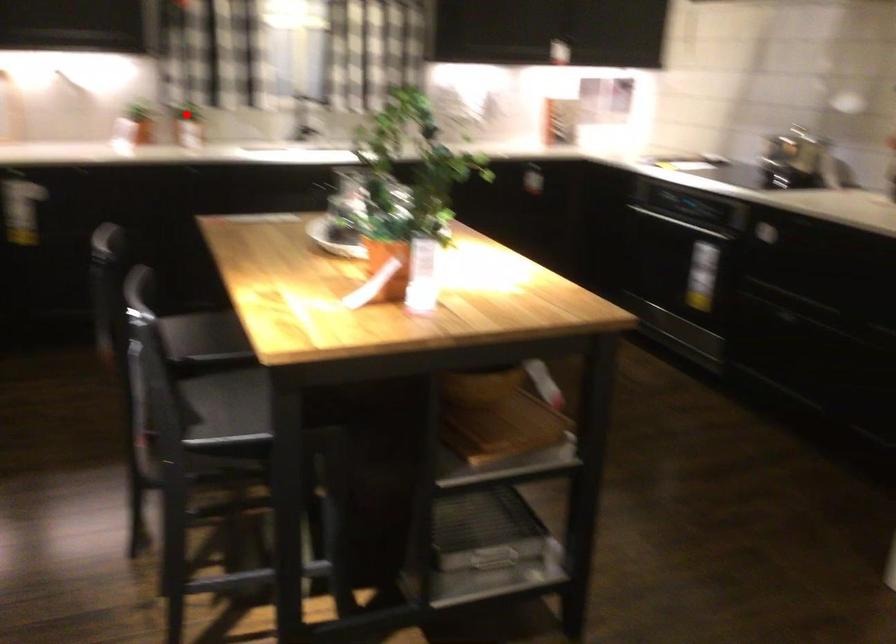
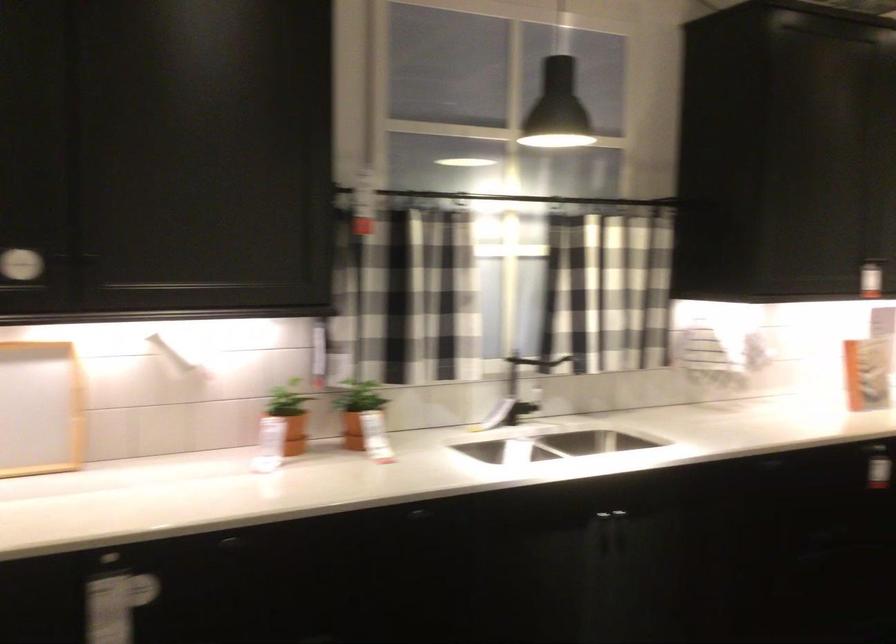
Question: I am providing you with two images of the same scene from different viewpoints. Image1 has a red point marked. In image2, the corresponding 3D location appears at what relative position? Reply with the corresponding letter.

Choices:
 (A) Closer
 (B) Farther

Answer: (A)